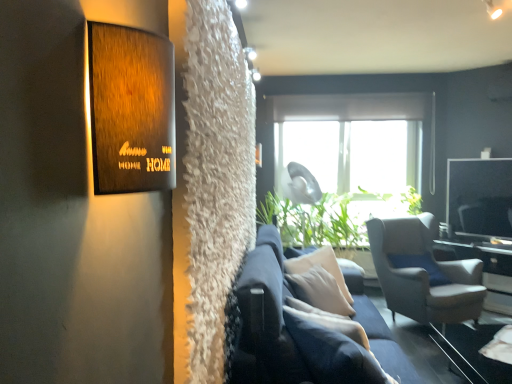
Question: Does point (474, 360) appear closer or farther from the camera than point (248, 357)?

Choices:
 (A) closer
 (B) farther

Answer: (B)

Question: From a real-world perspective, is transparent glass table at lower right positioned above or below navy blue fabric couch at center?

Choices:
 (A) above
 (B) below

Answer: (B)

Question: Which object is the closest to the white glossy table at right?

Choices:
 (A) transparent glass table at lower right
 (B) navy blue fabric couch at center
 (C) matte gray fabric armchair at right

Answer: (C)

Question: Which object is positioned closest to the matte gray fabric armchair at right?

Choices:
 (A) white glossy table at right
 (B) transparent glass table at lower right
 (C) navy blue fabric couch at center

Answer: (B)